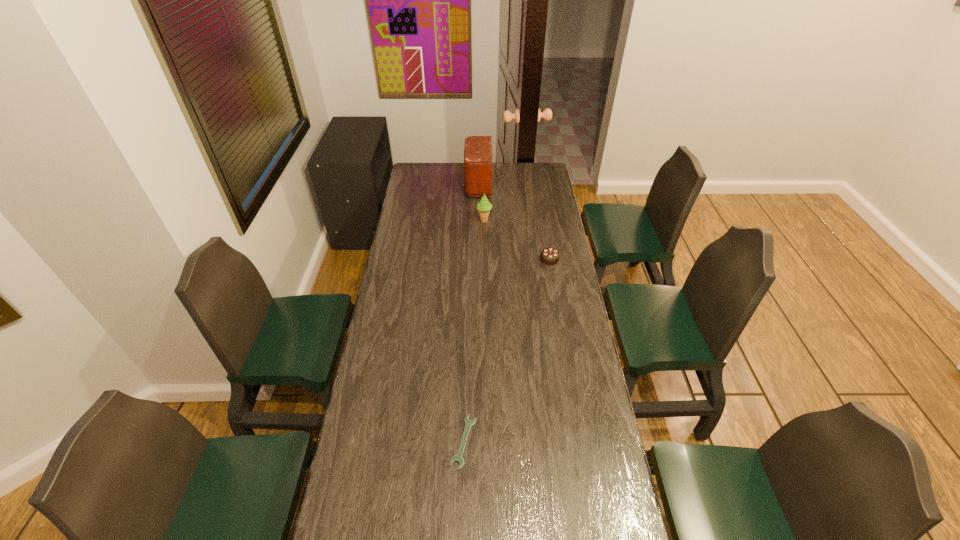
Locate an element on the screen. The height and width of the screenshot is (540, 960). vacant area between the nearest object and the icecream is located at coordinates (474, 331).

Where is `free space between the rightmost object and the radio receiver`? free space between the rightmost object and the radio receiver is located at coordinates (517, 222).

Identify the location of vacant area between the third farthest object and the icecream. (517, 240).

You are a GUI agent. You are given a task and a screenshot of the screen. Output one action in this format:
    pyautogui.click(x=<x>, y=<y>)
    Task: Click on the free space between the second nearest object and the shortest object
    Image resolution: width=960 pixels, height=540 pixels.
    Given the screenshot: What is the action you would take?
    pyautogui.click(x=507, y=350)

In order to click on empty space that is in between the wrench and the icecream in this screenshot , I will do `click(474, 331)`.

This screenshot has height=540, width=960. I want to click on unoccupied position between the shortest object and the rightmost object, so click(507, 350).

You are a GUI agent. You are given a task and a screenshot of the screen. Output one action in this format:
    pyautogui.click(x=<x>, y=<y>)
    Task: Click on the unoccupied area between the nearest object and the icecream
    The width and height of the screenshot is (960, 540).
    Given the screenshot: What is the action you would take?
    pyautogui.click(x=474, y=331)

You are a GUI agent. You are given a task and a screenshot of the screen. Output one action in this format:
    pyautogui.click(x=<x>, y=<y>)
    Task: Click on the free space that is in between the shortest object and the radio receiver
    Image resolution: width=960 pixels, height=540 pixels.
    Given the screenshot: What is the action you would take?
    pyautogui.click(x=474, y=313)

Where is `vacant point located between the chocolate cake and the tallest object`? The height and width of the screenshot is (540, 960). vacant point located between the chocolate cake and the tallest object is located at coordinates (517, 222).

Find the location of `the closest object relative to the shortest object`. the closest object relative to the shortest object is located at coordinates (550, 256).